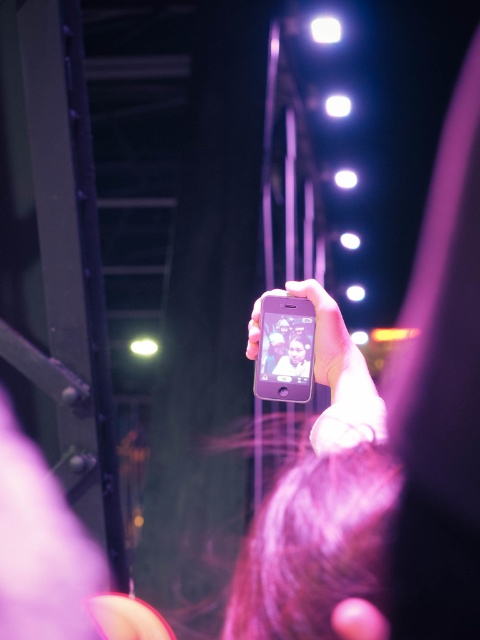
You are a photographer trying to capture a photo of both the matte purple phone at center and the matte silver phone at center. Since they are close together, you need to adjust your camera angle to ensure both are in focus. Which phone should you position closer to the camera to achieve this?

To ensure both the matte purple phone at center and the matte silver phone at center are in focus, position the matte silver phone at center closer to the camera since the matte purple phone at center is already to the right of it, creating a slight distance between them.

Looking at this image, you are a photographer trying to frame a shot of the industrial background in the image. The matte black smartphone at center is blocking your view. Can you estimate how far to the right or left you should move the smartphone to fully capture the background?

The matte black smartphone at center is located at coordinates point (x=285, y=349). To fully capture the background, you would need to move the smartphone either to the left or right until it is no longer obstructing the view of the industrial setting in the background.

Consider the image. You are a photographer trying to frame a shot of the matte purple phone at center in the image. The camera has a grid overlay with coordinates from 0 to 1 on both axes. Where should you position the phone to be exactly at the center of the frame?

The matte purple phone at center is already positioned at the center of the frame since its coordinates are at approximately 0.5 on both the x and y axes, which corresponds to the center point in a 0 to 1 grid system.